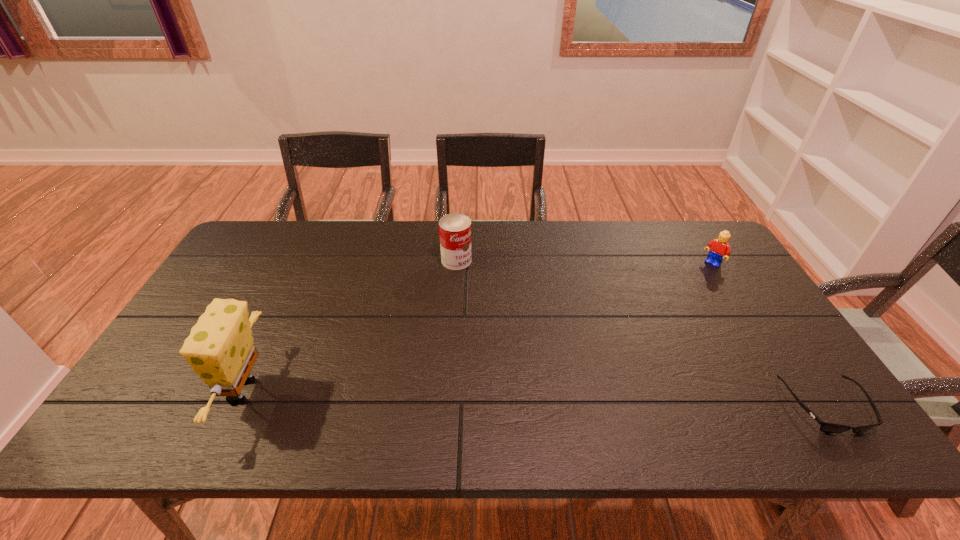
You are a GUI agent. You are given a task and a screenshot of the screen. Output one action in this format:
    pyautogui.click(x=<x>, y=<y>)
    Task: Click on the vacant space on the desktop that is between the leftmost object and the shortest object and is positioned on the front label of the third object from right to left
    The image size is (960, 540).
    Given the screenshot: What is the action you would take?
    pyautogui.click(x=610, y=401)

I want to click on free space on the desktop that is between the tallest object and the shortest object and is positioned on the front-facing side of the Lego, so click(558, 399).